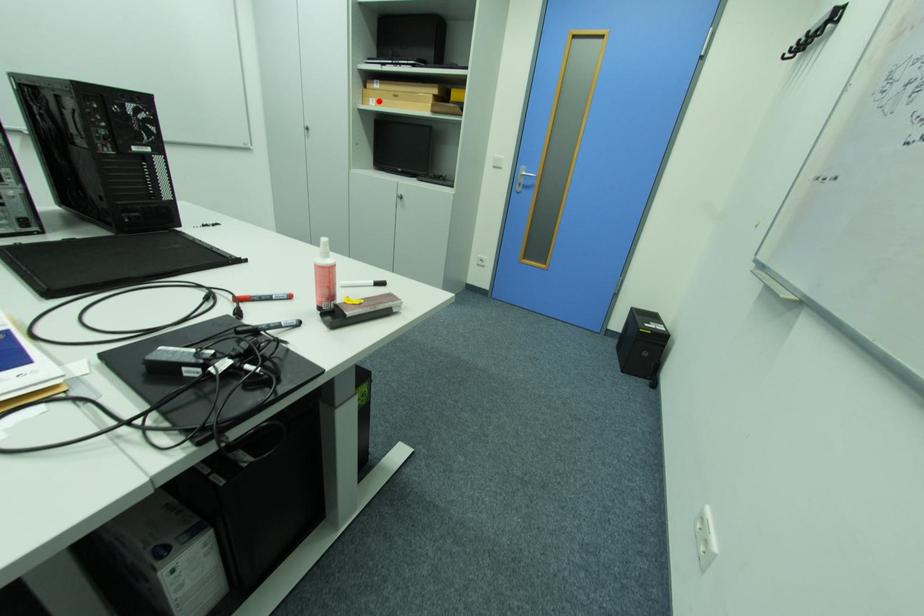
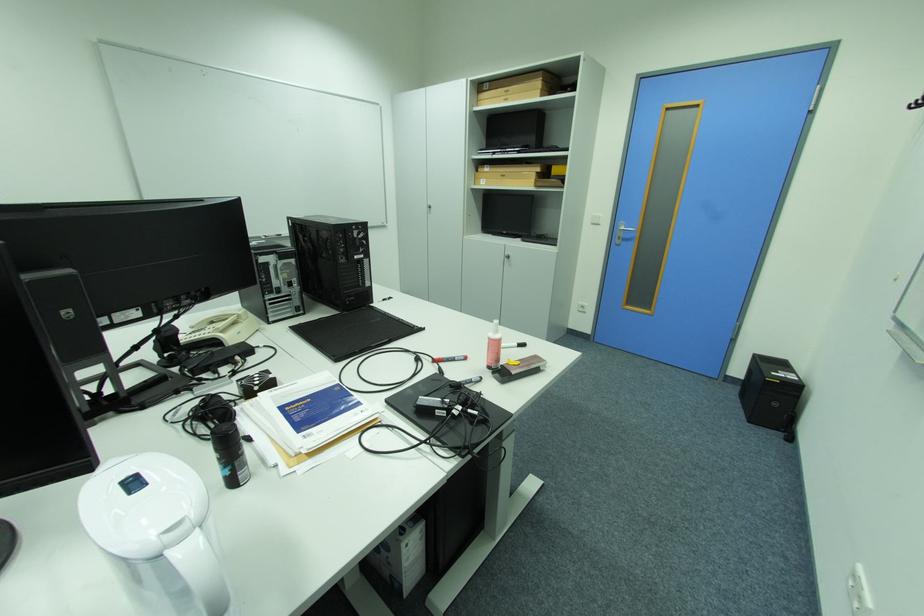
Where in the second image is the point corresponding to the highlighted location from the first image?

(490, 180)